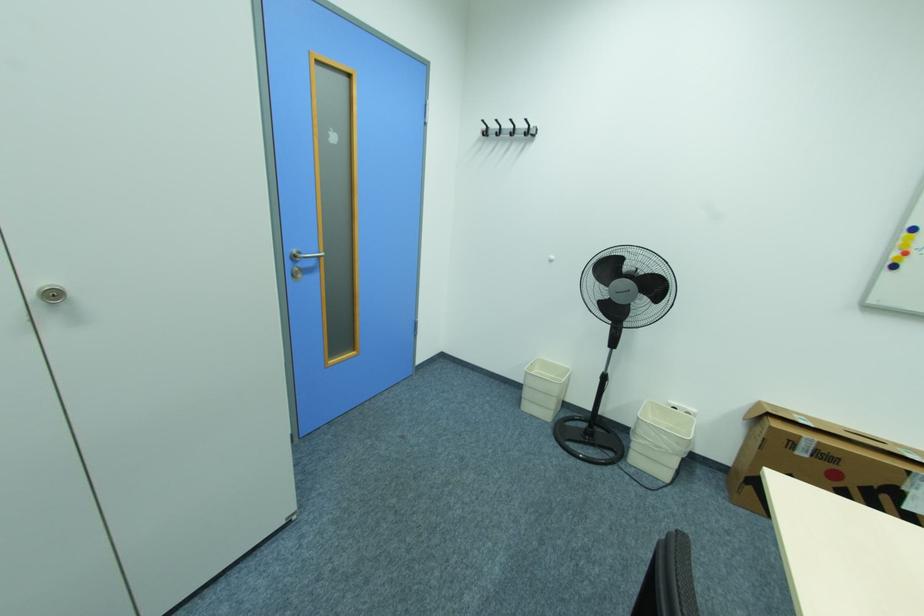
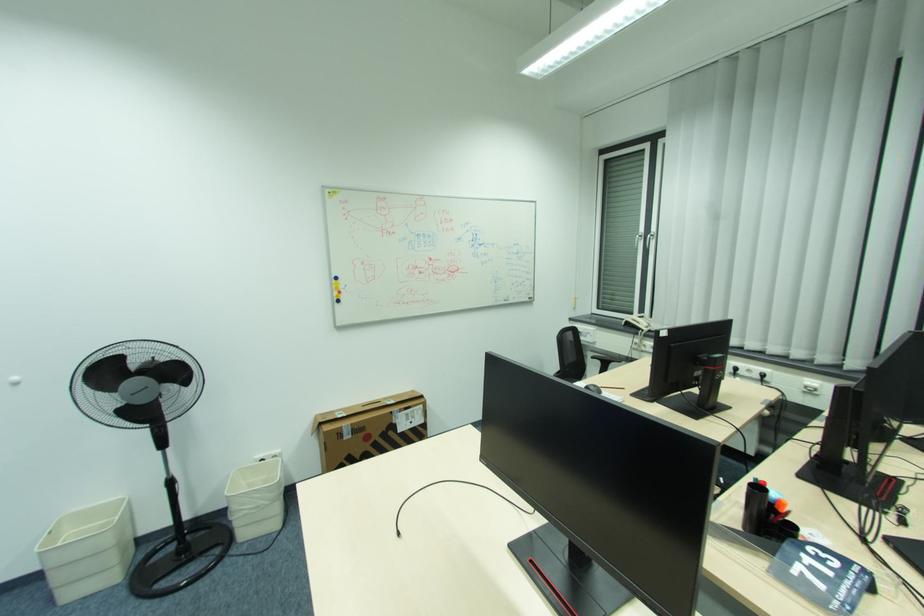
Question: The images are taken continuously from a first-person perspective. In which direction is your viewpoint rotating?

Choices:
 (A) Left
 (B) Right
 (C) Up
 (D) Down

Answer: (B)